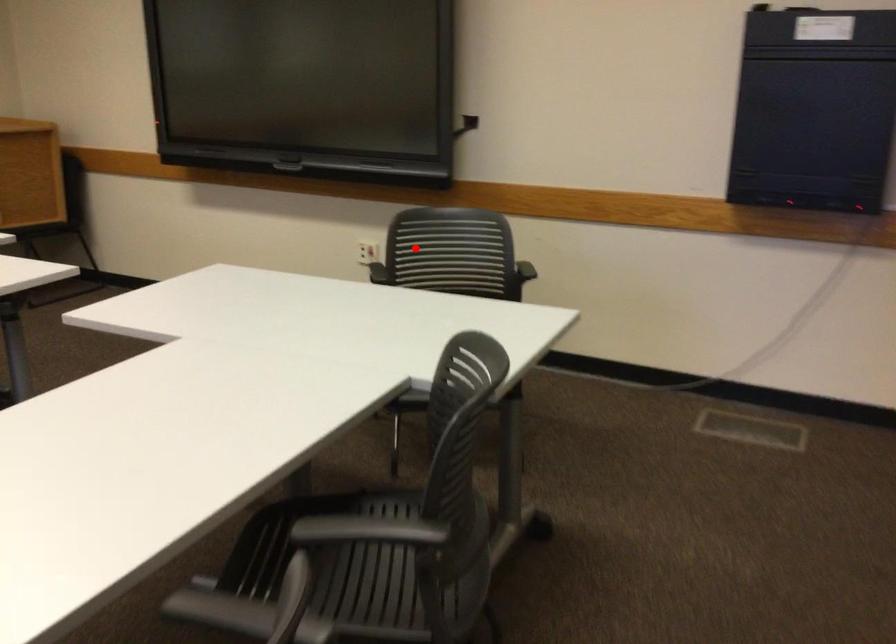
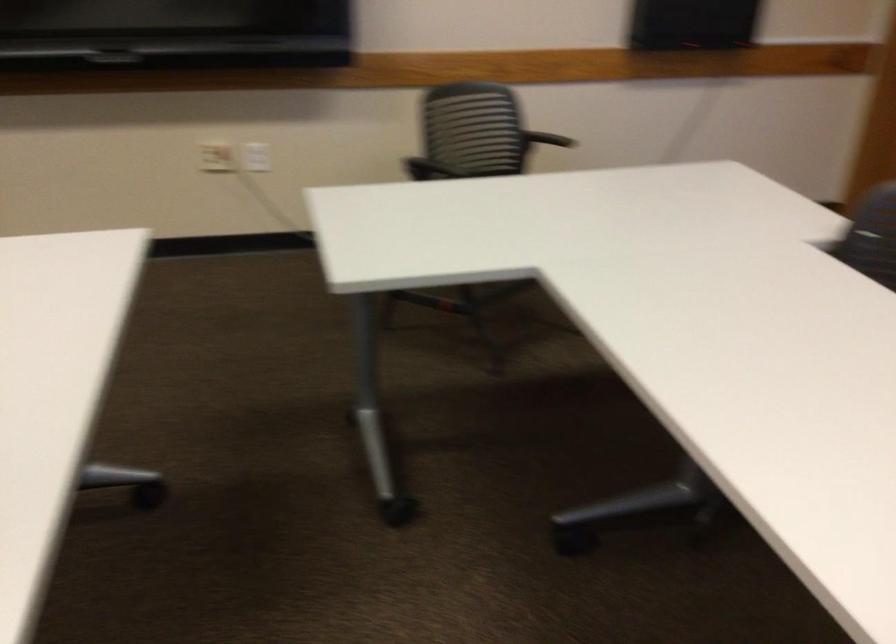
Question: I am providing you with two images of the same scene from different viewpoints. In image1, a red point is highlighted. Considering the same 3D point in image2, which of the following is correct?

Choices:
 (A) It is closer
 (B) It is farther

Answer: (A)